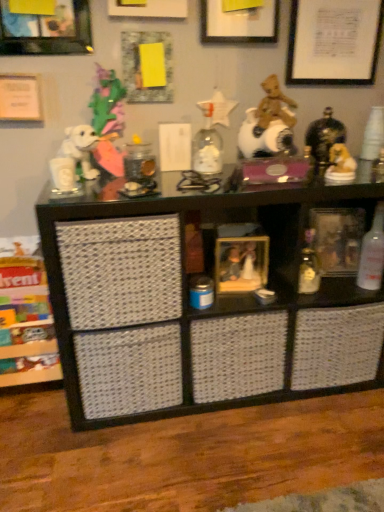
Question: Should I look upward or downward to see white glossy horse at upper right, the 2th toy when ordered from bottom to top?

Choices:
 (A) up
 (B) down

Answer: (A)

Question: Considering the relative sizes of brushed metal picture frame at upper left, marked as the fifth picture frame in a right-to-left arrangement, and clear glass bottle at right in the image provided, is brushed metal picture frame at upper left, marked as the fifth picture frame in a right-to-left arrangement, taller than clear glass bottle at right?

Choices:
 (A) no
 (B) yes

Answer: (A)

Question: From a real-world perspective, is brushed metal picture frame at upper left, marked as the fifth picture frame in a right-to-left arrangement, positioned over clear glass bottle at right based on gravity?

Choices:
 (A) no
 (B) yes

Answer: (B)

Question: Is brushed metal picture frame at upper left, the 1th picture frame when ordered from left to right, oriented away from clear glass bottle at right?

Choices:
 (A) yes
 (B) no

Answer: (B)

Question: Is clear glass bottle at right located within brushed metal picture frame at upper left, marked as the fifth picture frame in a right-to-left arrangement?

Choices:
 (A) no
 (B) yes

Answer: (A)

Question: Considering the relative sizes of brushed metal picture frame at upper left, the 1th picture frame when ordered from left to right, and clear glass bottle at right in the image provided, is brushed metal picture frame at upper left, the 1th picture frame when ordered from left to right, bigger than clear glass bottle at right?

Choices:
 (A) no
 (B) yes

Answer: (B)

Question: Can you confirm if brushed metal picture frame at upper left, acting as the 4th picture frame starting from the top, is positioned to the left of clear glass bottle at right?

Choices:
 (A) no
 (B) yes

Answer: (B)

Question: Is white matte picture frame at upper right, positioned as the first picture frame in right-to-left order, facing towards clear glass bottle at right?

Choices:
 (A) yes
 (B) no

Answer: (B)

Question: Are white matte picture frame at upper right, arranged as the fifth picture frame when viewed from the left, and clear glass bottle at right located far from each other?

Choices:
 (A) no
 (B) yes

Answer: (A)

Question: Considering the relative positions of white matte picture frame at upper right, positioned as the first picture frame in right-to-left order, and clear glass bottle at right in the image provided, is white matte picture frame at upper right, positioned as the first picture frame in right-to-left order, to the left of clear glass bottle at right from the viewer's perspective?

Choices:
 (A) no
 (B) yes

Answer: (B)

Question: Is white matte picture frame at upper right, arranged as the fifth picture frame when viewed from the left, further to camera compared to clear glass bottle at right?

Choices:
 (A) no
 (B) yes

Answer: (B)

Question: From a real-world perspective, is white matte picture frame at upper right, arranged as the third picture frame when viewed from the top, below clear glass bottle at right?

Choices:
 (A) no
 (B) yes

Answer: (A)

Question: Is clear glass bottle at right at the back of white matte picture frame at upper right, positioned as the first picture frame in right-to-left order?

Choices:
 (A) yes
 (B) no

Answer: (B)

Question: Does black woven basket at center, placed as the first shelf when sorted from right to left, appear on the left side of wooden crate at lower left, which is the second shelf from right to left?

Choices:
 (A) yes
 (B) no

Answer: (B)